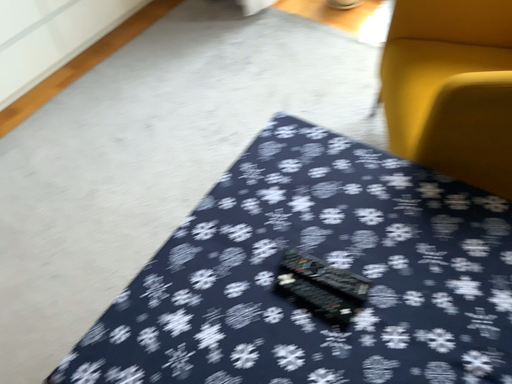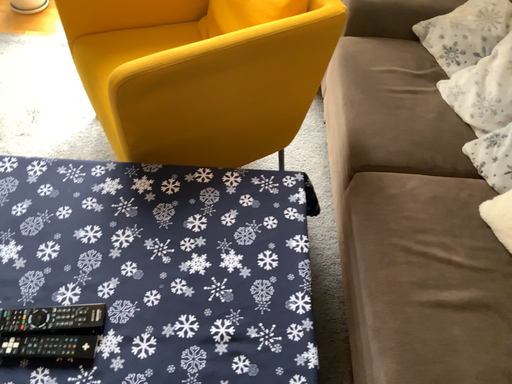
Question: How did the camera likely rotate when shooting the video?

Choices:
 (A) rotated left
 (B) rotated right

Answer: (B)